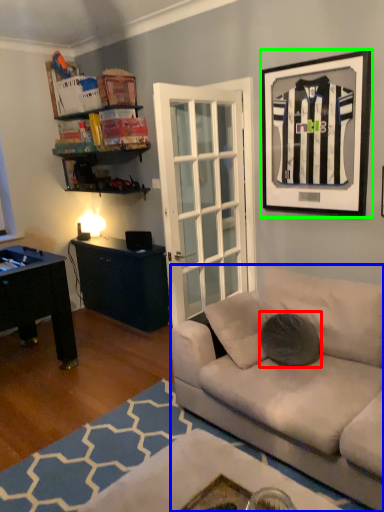
Question: Which object is positioned farthest from pillow (highlighted by a red box)? Select from studio couch (highlighted by a blue box) and picture frame (highlighted by a green box).

Choices:
 (A) studio couch
 (B) picture frame

Answer: (B)